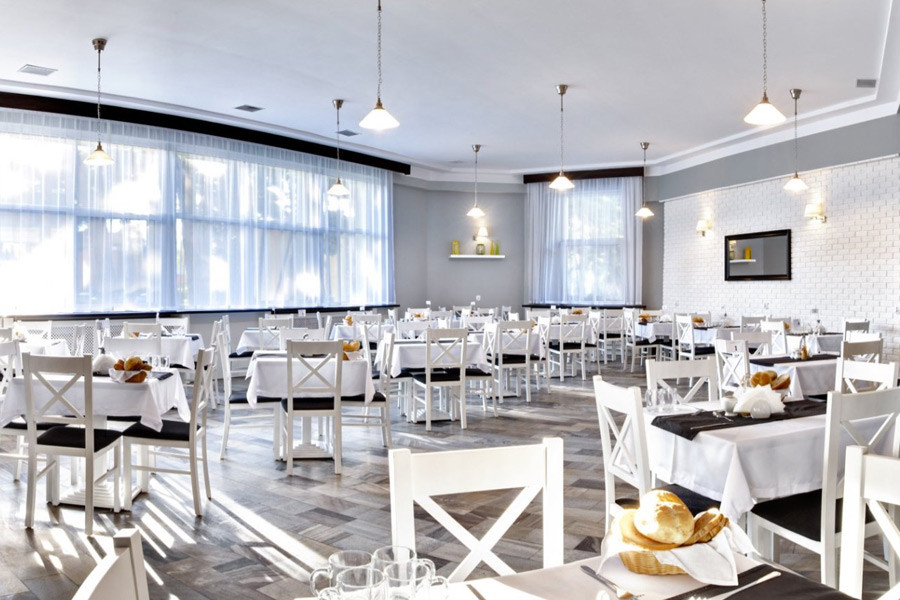
The width and height of the screenshot is (900, 600). Find the location of `lights`. lights is located at coordinates (379, 121), (348, 184), (100, 171), (474, 214), (565, 184), (643, 211), (762, 115), (797, 184), (814, 214), (704, 229).